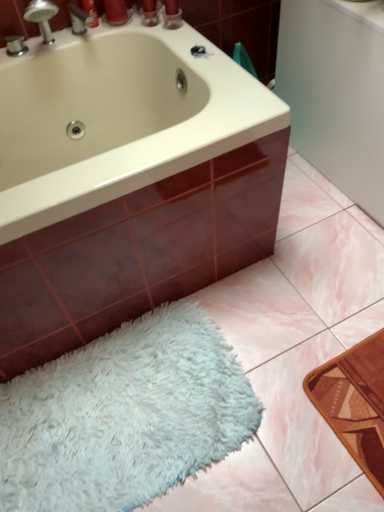
Where is `vacant area that is situated to the right of white fluffy bath mat at lower left`? The width and height of the screenshot is (384, 512). vacant area that is situated to the right of white fluffy bath mat at lower left is located at coordinates (297, 362).